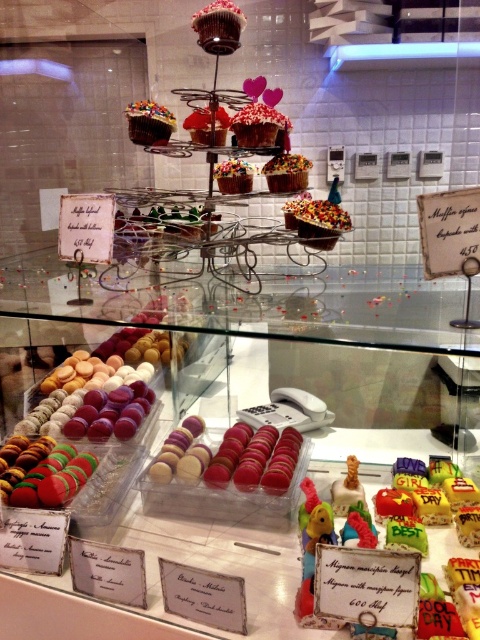
You are standing in front of the display case and want to reach the point at coordinates point (146, 120). If your arm can extend 1.0 meters, can you reach it?

The point (146, 120) is 1.20 meters away from the viewer, which is beyond the 1.0 meters your arm can extend. Therefore, you cannot reach it.

You are a customer looking at the display case and want to pick up the item at point (60, 499) and the item at point (214, 42). Which item will you reach first if you start from the front of the display case?

You will reach the item at point (60, 499) first because it is in front of the item at point (214, 42).

You are a customer at a bakery and want to choose between the multicolored macarons at lower left and the sprinkled chocolate cupcake at center. Based on their sizes, which one do you think is wider?

The multicolored macarons at lower left are wider than the sprinkled chocolate cupcake at center.